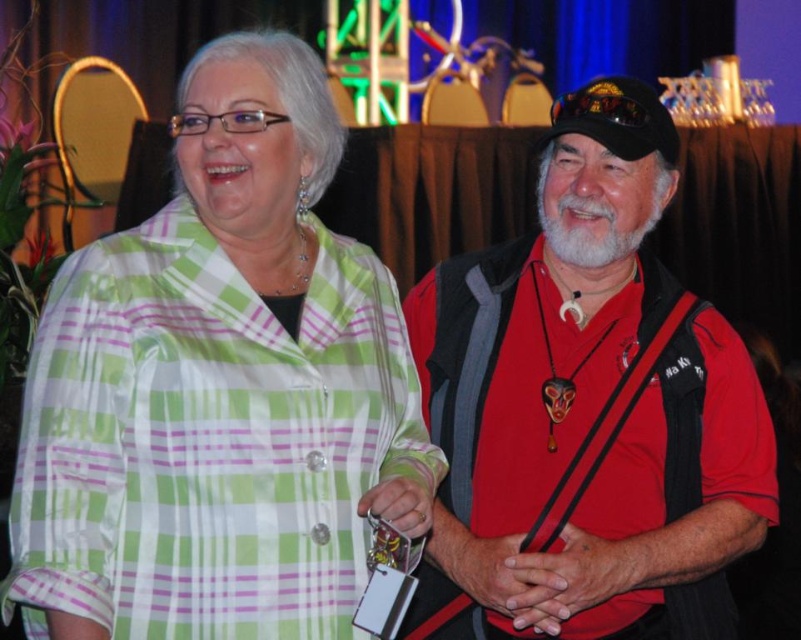
You are planning to take a photo of the green plaid shirt at upper left and the red matte vest at right. The camera you have can only focus on objects within 3 meters. Will both subjects be in focus?

The green plaid shirt at upper left is 3.59 meters away from the red matte vest at right, which means the distance between them is greater than 3 meters. Therefore, the camera cannot focus on both subjects simultaneously since they are beyond the 3 meter range.

You are organizing a photo shoot and need to place two props next to the green plaid shirt at upper left and the red matte vest at right. Which prop should you place closer to the camera to ensure both appear the same size in the photo?

The green plaid shirt at upper left has a lesser width compared to the red matte vest at right, so you should place the prop closer to the camera next to the green plaid shirt at upper left to compensate for its smaller size and make both appear the same size in the photo.